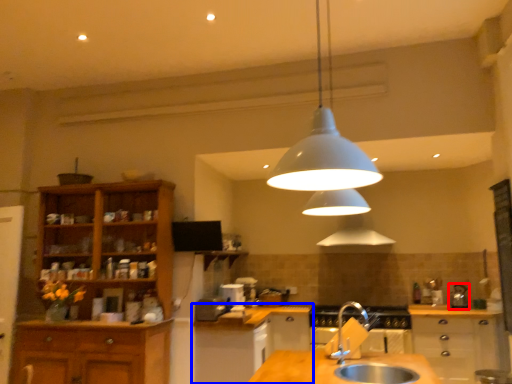
Question: Which object is further to the camera taking this photo, appliance (highlighted by a red box) or cabinetry (highlighted by a blue box)?

Choices:
 (A) appliance
 (B) cabinetry

Answer: (A)